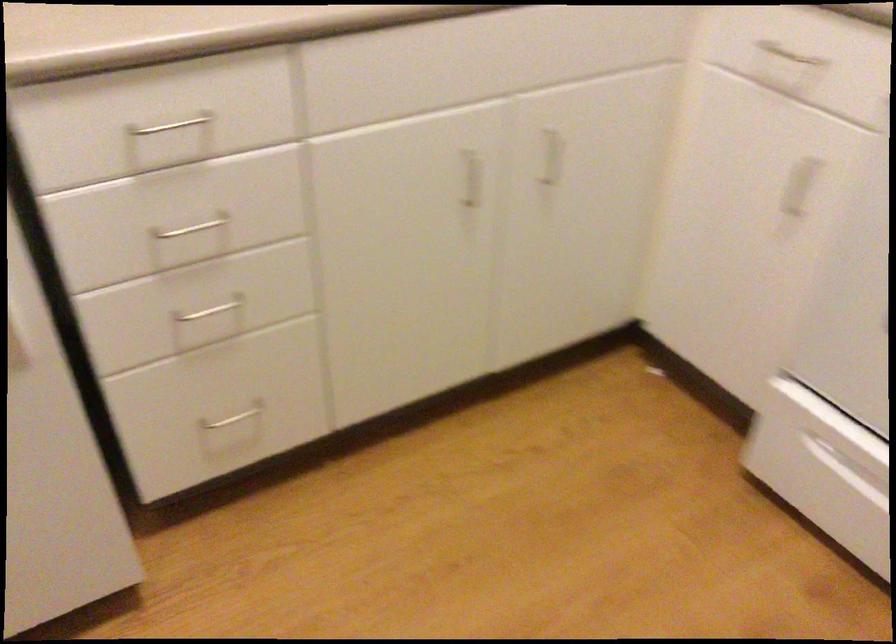
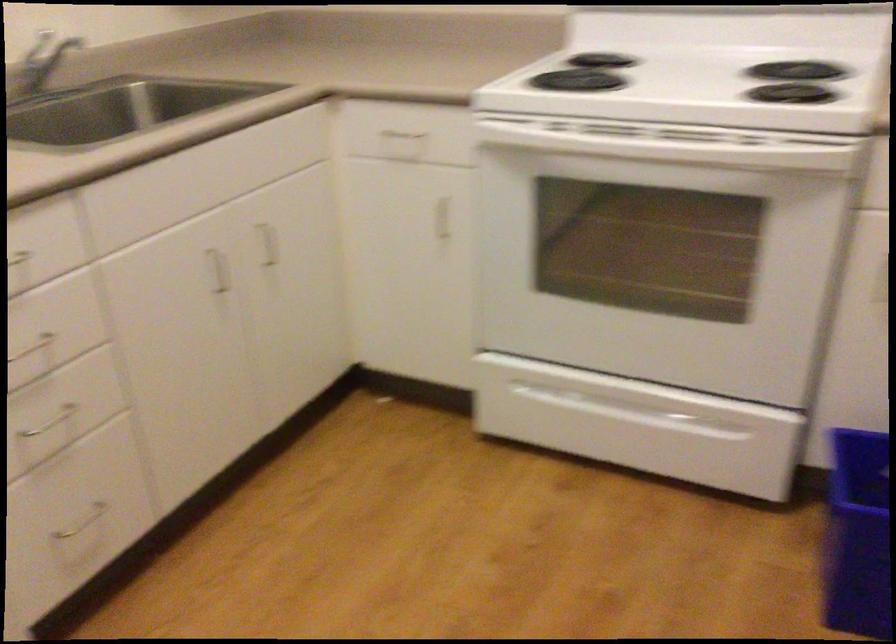
Question: The camera is either moving clockwise (left) or counter-clockwise (right) around the object. The first image is from the beginning of the video and the second image is from the end. Is the camera moving left or right when shooting the video?

Choices:
 (A) Left
 (B) Right

Answer: (A)